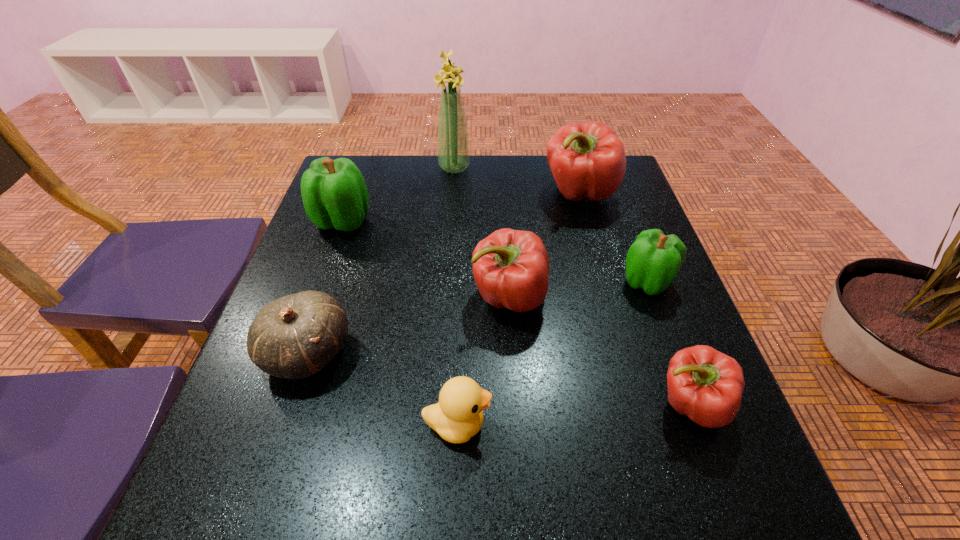
This screenshot has height=540, width=960. I want to click on green bouquet, so click(x=453, y=148).

You are a GUI agent. You are given a task and a screenshot of the screen. Output one action in this format:
    pyautogui.click(x=<x>, y=<y>)
    Task: Click on the tallest object
    The height and width of the screenshot is (540, 960).
    Given the screenshot: What is the action you would take?
    pyautogui.click(x=453, y=148)

Locate an element on the screen. Image resolution: width=960 pixels, height=540 pixels. the farthest pink bell pepper is located at coordinates (587, 160).

Find the location of a particular element. This screenshot has width=960, height=540. the leftmost bell pepper is located at coordinates (334, 193).

Where is `the bigger green bell pepper`? This screenshot has width=960, height=540. the bigger green bell pepper is located at coordinates (334, 193).

At what (x,y) coordinates should I click in order to perform the action: click on the leftmost pink bell pepper. Please return your answer as a coordinate pair (x, y). Looking at the image, I should click on (511, 267).

At what (x,y) coordinates should I click in order to perform the action: click on the fourth bell pepper from right to left. Please return your answer as a coordinate pair (x, y). Looking at the image, I should click on (511, 267).

Find the location of a particular element. This screenshot has height=540, width=960. the right green bell pepper is located at coordinates (653, 261).

Image resolution: width=960 pixels, height=540 pixels. I want to click on the smaller green bell pepper, so click(653, 261).

The height and width of the screenshot is (540, 960). I want to click on gourd, so click(294, 337).